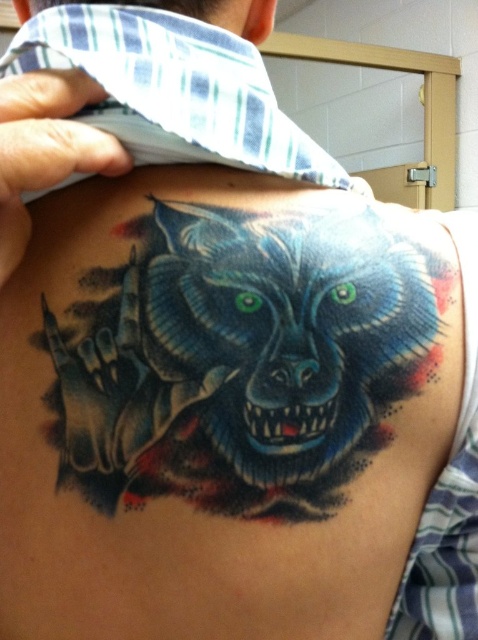
Does colorful ink wolf at upper right have a greater height compared to blue plaid tie at upper left?

Indeed, colorful ink wolf at upper right has a greater height compared to blue plaid tie at upper left.

Which of these two, colorful ink wolf at upper right or blue plaid tie at upper left, stands shorter?

With less height is blue plaid tie at upper left.

Is point (201, 330) closer to camera compared to point (231, 58)?

Yes, point (201, 330) is closer to viewer.

Locate an element on the screen. colorful ink wolf at upper right is located at coordinates (245, 353).

Does blue plaid tie at upper left come behind matte blue neck at upper center?

No.

Where is `blue plaid tie at upper left`? blue plaid tie at upper left is located at coordinates (173, 90).

Where is `blue plaid tie at upper left`? blue plaid tie at upper left is located at coordinates (173, 90).

Does colorful ink wolf at upper right appear under matte blue neck at upper center?

Indeed, colorful ink wolf at upper right is positioned under matte blue neck at upper center.

Is colorful ink wolf at upper right behind matte blue neck at upper center?

No, colorful ink wolf at upper right is in front of matte blue neck at upper center.

Locate an element on the screen. colorful ink wolf at upper right is located at coordinates (245, 353).

At what (x,y) coordinates should I click in order to perform the action: click on colorful ink wolf at upper right. Please return your answer as a coordinate pair (x, y). Image resolution: width=478 pixels, height=640 pixels. Looking at the image, I should click on (245, 353).